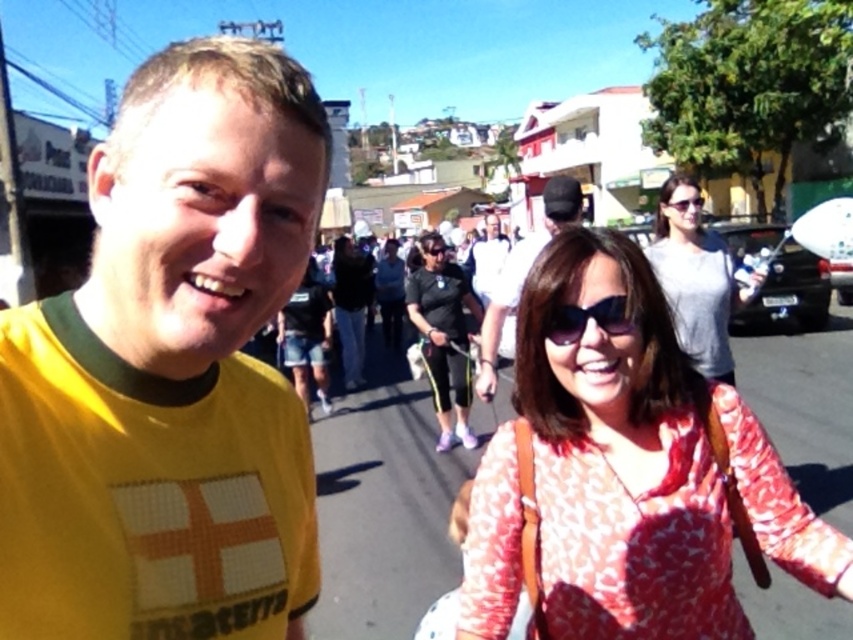
Question: Which of the following is the farthest from the observer?

Choices:
 (A) pos(430,250)
 (B) pos(621,426)

Answer: (A)

Question: Is white matte shirt at center in front of matte black sunglasses at center?

Choices:
 (A) yes
 (B) no

Answer: (B)

Question: Is matte black cap at center bigger than white matte shirt at center?

Choices:
 (A) no
 (B) yes

Answer: (A)

Question: Estimate the real-world distances between objects in this image. Which object is closer to the sunglasses at center?

Choices:
 (A) gray cotton shirt at upper right
 (B) white matte shirt at center
 (C) black plastic goggles at center
 (D) matte black sunglasses at center

Answer: (A)

Question: Which object is closer to the camera taking this photo?

Choices:
 (A) printed cotton blouse at center
 (B) white matte shirt at center

Answer: (A)

Question: Is printed cotton blouse at center bigger than gray cotton shirt at upper right?

Choices:
 (A) no
 (B) yes

Answer: (A)